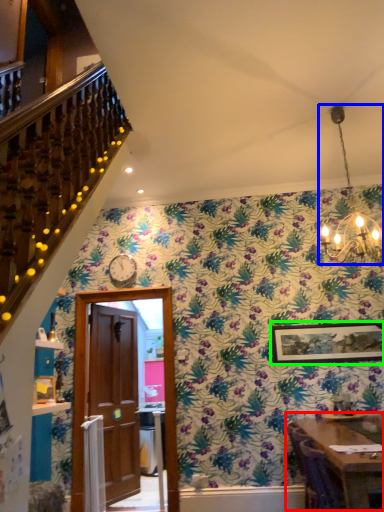
Question: Estimate the real-world distances between objects in this image. Which object is farther from table (highlighted by a red box), light fixture (highlighted by a blue box) or picture frame (highlighted by a green box)?

Choices:
 (A) light fixture
 (B) picture frame

Answer: (A)